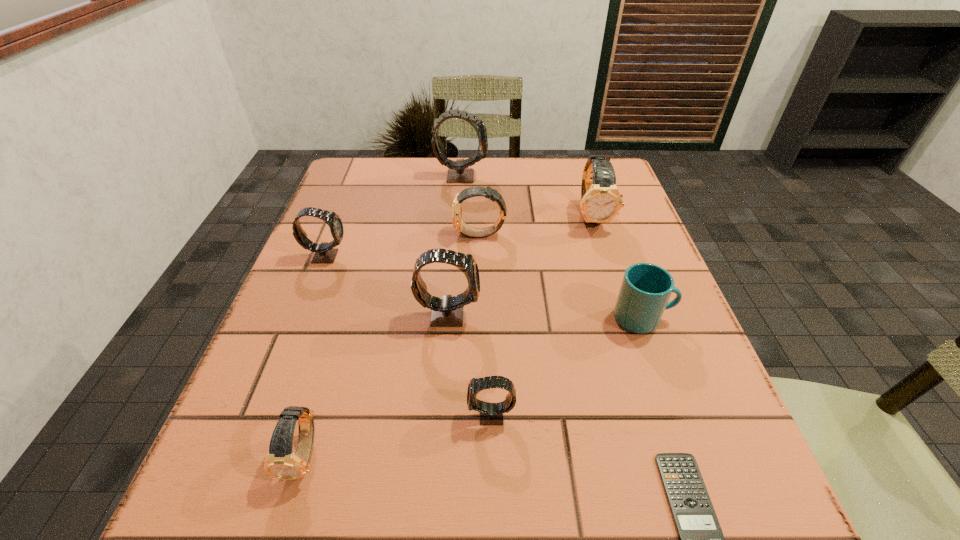
I want to click on unoccupied position between the cup and the biggest gray watch, so click(x=552, y=247).

Where is `vacant space that is in between the nearest gray watch and the fourth farthest watch`? vacant space that is in between the nearest gray watch and the fourth farthest watch is located at coordinates [408, 336].

Locate an element on the screen. This screenshot has width=960, height=540. unoccupied position between the fourth farthest watch and the farthest gray watch is located at coordinates (394, 216).

Identify which object is located as the sixth nearest to the farthest watch. Please provide its 2D coordinates. Your answer should be formatted as a tuple, i.e. [(x, y)], where the tuple contains the x and y coordinates of a point satisfying the conditions above.

[(490, 413)]

Locate which object ranks in proximity to the smallest gray watch. Please provide its 2D coordinates. Your answer should be formatted as a tuple, i.e. [(x, y)], where the tuple contains the x and y coordinates of a point satisfying the conditions above.

[(447, 311)]

The height and width of the screenshot is (540, 960). Identify the location of the sixth closest watch to the shortest object. (325, 252).

Where is `watch that is the second closest to the nearest gray watch`? The image size is (960, 540). watch that is the second closest to the nearest gray watch is located at coordinates (281, 462).

Identify which gray watch is the third nearest to the tallest object. Please provide its 2D coordinates. Your answer should be formatted as a tuple, i.e. [(x, y)], where the tuple contains the x and y coordinates of a point satisfying the conditions above.

[(490, 413)]

Locate an element on the screen. The width and height of the screenshot is (960, 540). gray watch identified as the closest to the second gold watch from left to right is located at coordinates (447, 311).

Select which gold watch appears as the third closest to the calculator. Please provide its 2D coordinates. Your answer should be formatted as a tuple, i.e. [(x, y)], where the tuple contains the x and y coordinates of a point satisfying the conditions above.

[(601, 201)]